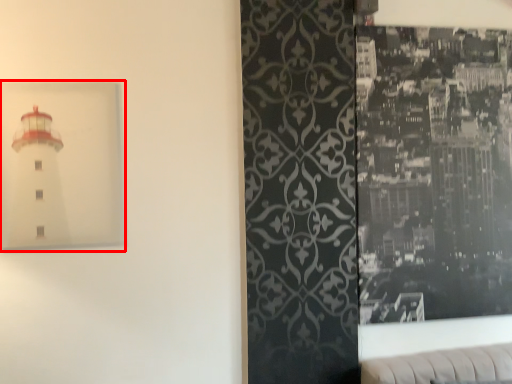
Question: Observing the image, what is the correct spatial positioning of picture frame (annotated by the red box) in reference to picture frame?

Choices:
 (A) right
 (B) left

Answer: (B)